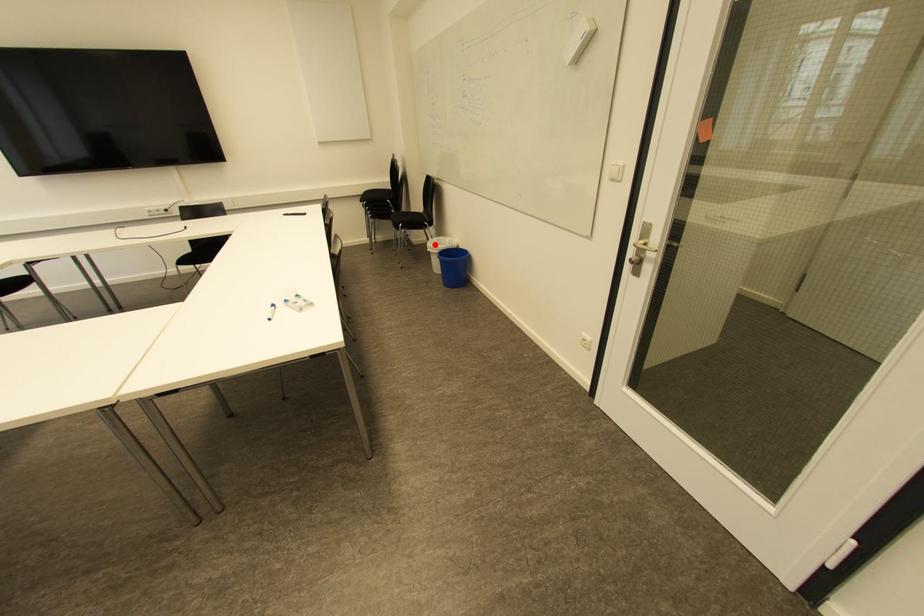
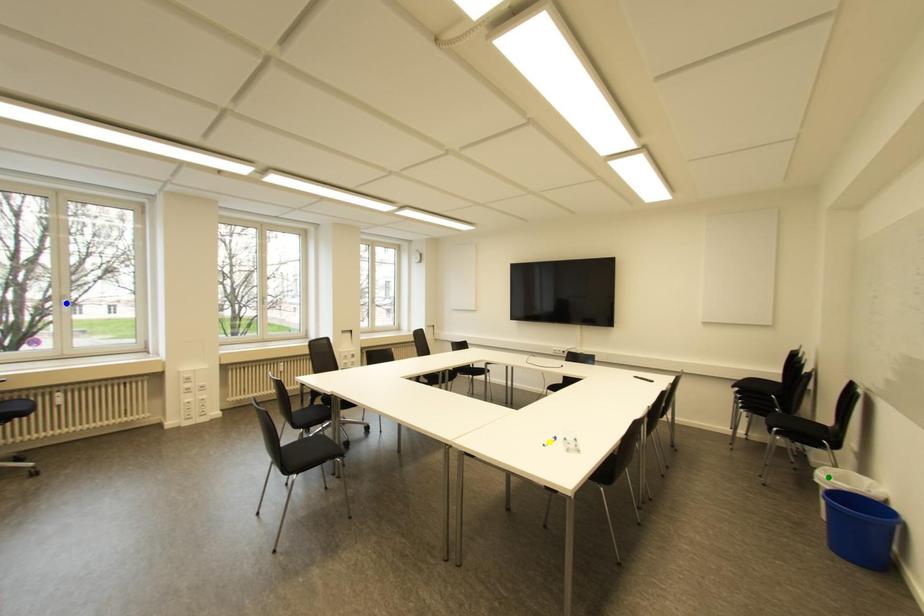
Question: I am providing you with two images of the same scene from different viewpoints. A red point is marked on the first image. You are given multiple points on the second image. Can you choose the point in image 2 that corresponds to the point in image 1?

Choices:
 (A) blue point
 (B) green point
 (C) yellow point

Answer: (B)